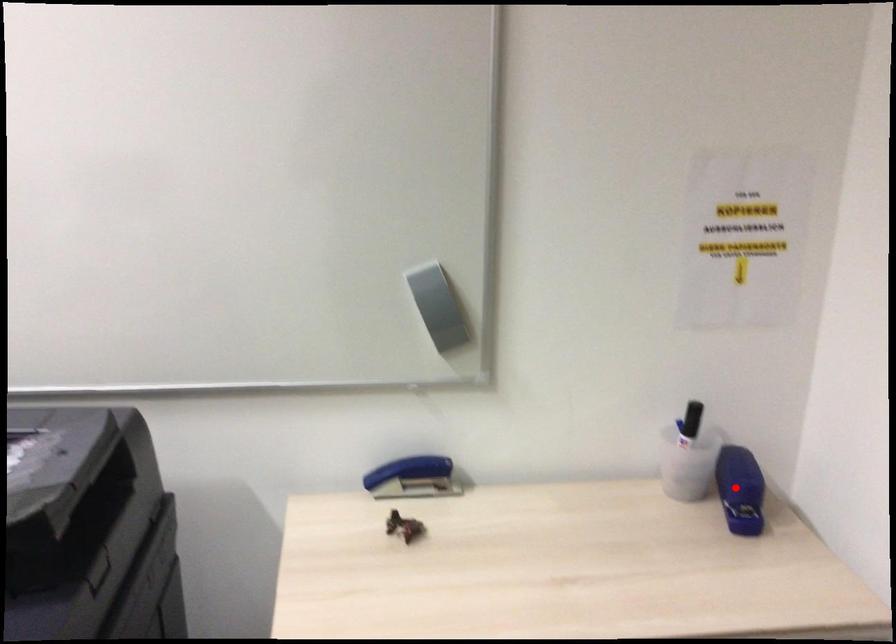
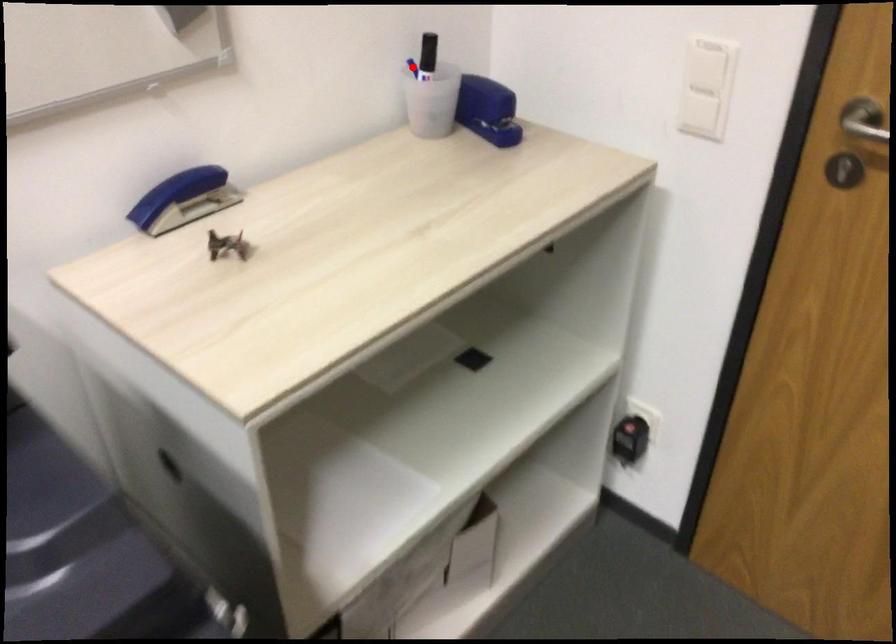
I am providing you with two images of the same scene from different viewpoints. A red point is marked on the first image and another point is marked on the second image. Do the highlighted points in image1 and image2 indicate the same real-world spot?

No